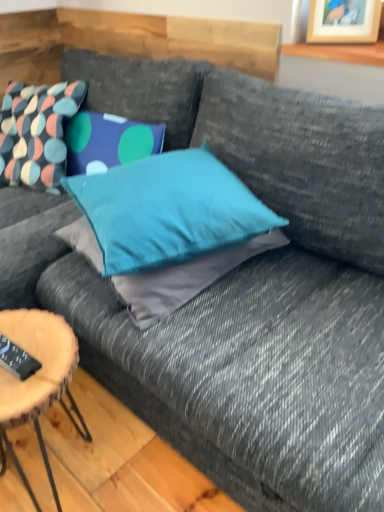
Question: Based on their positions, is teal fabric pillow at center, marked as the 2th pillow in a left-to-right arrangement, located to the left or right of black plastic remote control at lower left?

Choices:
 (A) right
 (B) left

Answer: (A)

Question: Is teal fabric pillow at center, acting as the 2th pillow starting from the back, in front of or behind black plastic remote control at lower left in the image?

Choices:
 (A) behind
 (B) front

Answer: (A)

Question: Which is nearer to the wooden log coffee table at lower left?

Choices:
 (A) black plastic remote control at lower left
 (B) teal fabric pillow at center, arranged as the first pillow when viewed from the front
 (C) multicolored fabric pillow at upper left, positioned as the first pillow in back-to-front order
 (D) wooden picture frame at upper right

Answer: (A)

Question: Which is nearer to the black plastic remote control at lower left?

Choices:
 (A) wooden log coffee table at lower left
 (B) wooden picture frame at upper right
 (C) teal fabric pillow at center, marked as the 2th pillow in a left-to-right arrangement
 (D) multicolored fabric pillow at upper left, which appears as the first pillow when viewed from the left

Answer: (A)